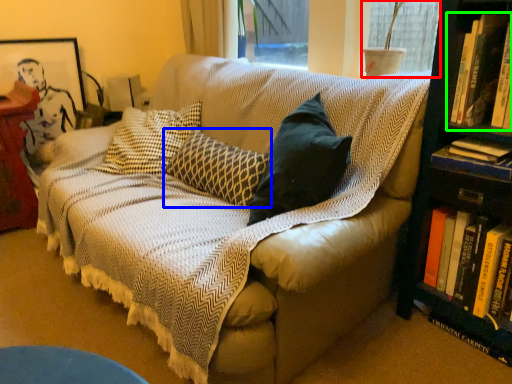
Question: Which object is positioned farthest from window screen (highlighted by a red box)? Select from pillow (highlighted by a blue box) and book (highlighted by a green box).

Choices:
 (A) pillow
 (B) book

Answer: (A)